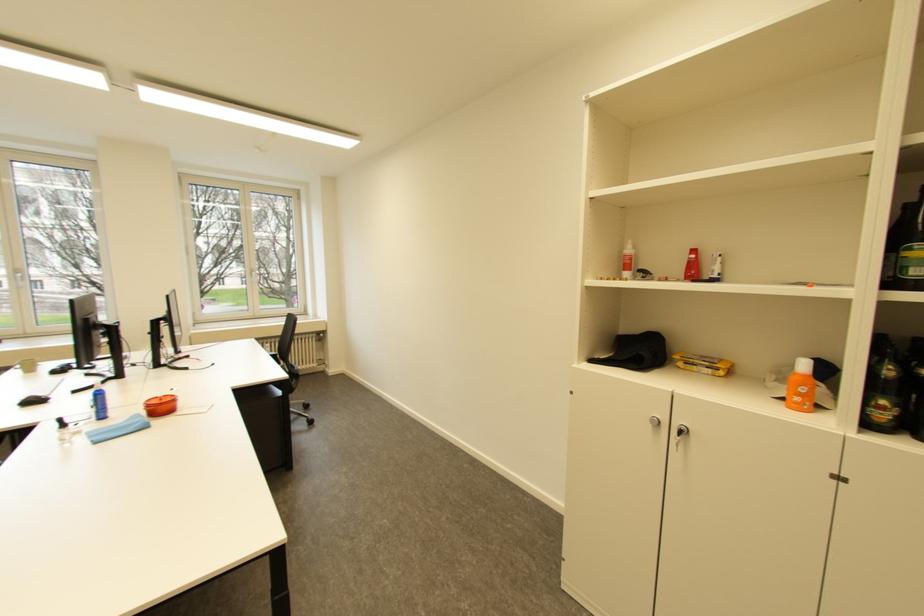
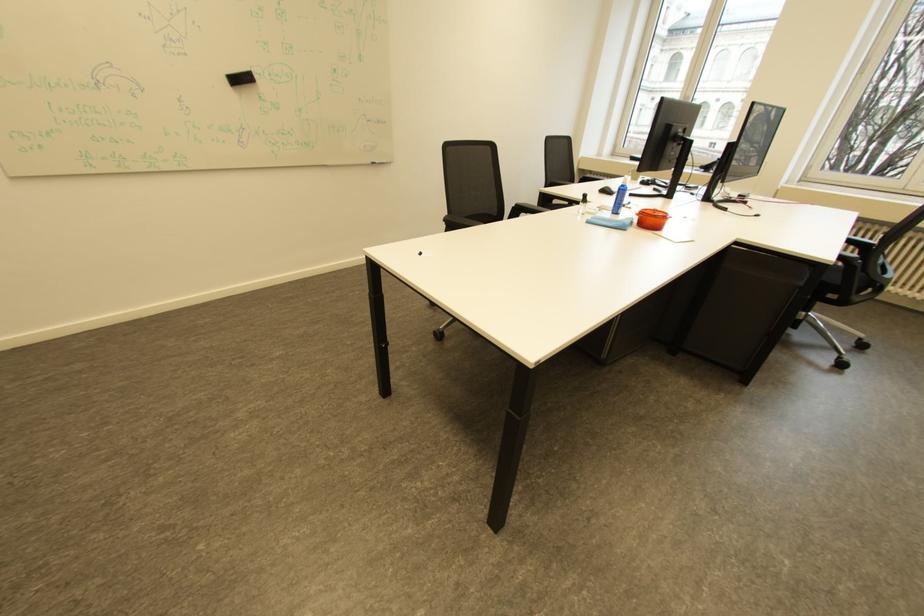
First-person continuous shooting, in which direction is the camera rotating?

The rotation direction of the camera is left-down.